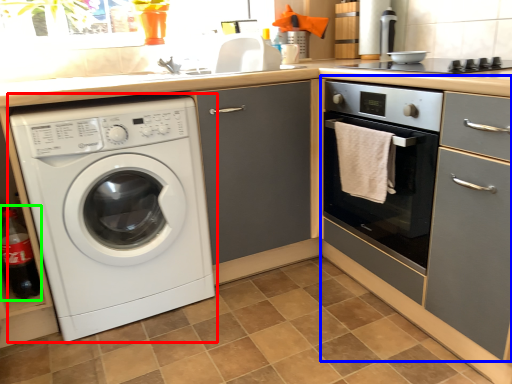
Question: Based on their relative distances, which object is farther from washing machine (highlighted by a red box)? Choose from cabinetry (highlighted by a blue box) and bottle (highlighted by a green box).

Choices:
 (A) cabinetry
 (B) bottle

Answer: (A)